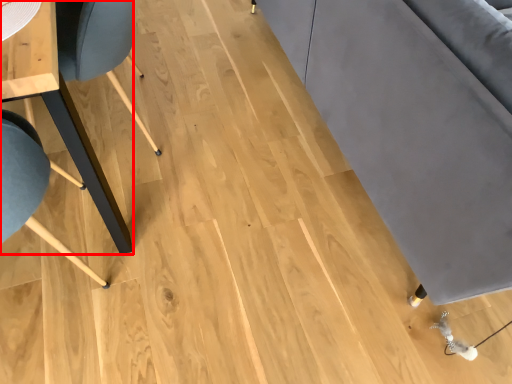
Question: From the image's perspective, what is the correct spatial positioning of table (annotated by the red box) in reference to couch?

Choices:
 (A) below
 (B) above

Answer: (A)